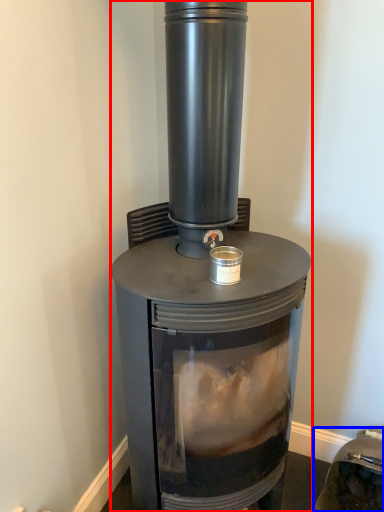
Question: Which point is closer to the camera, wood burning stove (highlighted by a red box) or appliance (highlighted by a blue box)?

Choices:
 (A) wood burning stove
 (B) appliance

Answer: (A)